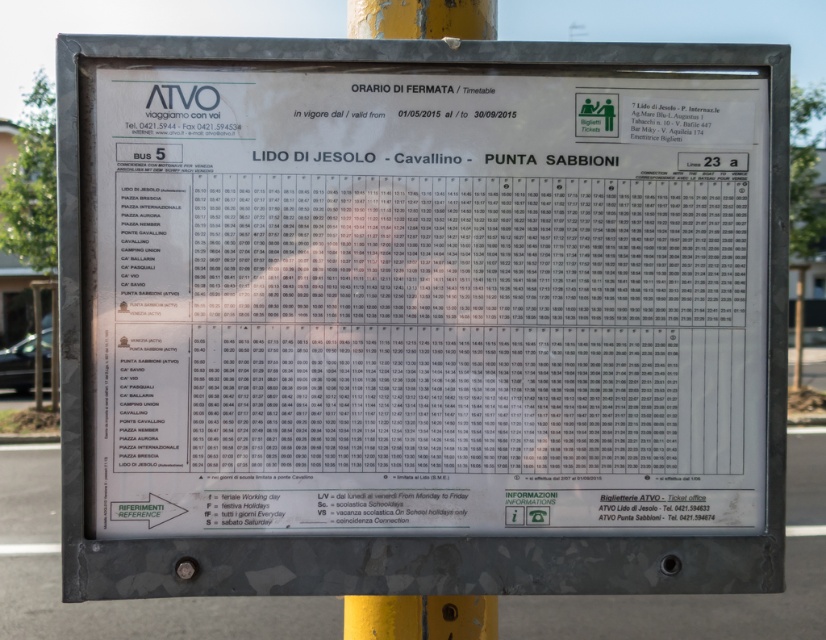
You are a tourist in Venice and see the white paper timetable at center and the yellow painted metal pole at upper center on a bus stop board. Which object takes up more space on the board?

The white paper timetable at center is larger in size than the yellow painted metal pole at upper center, so it takes up more space on the board.